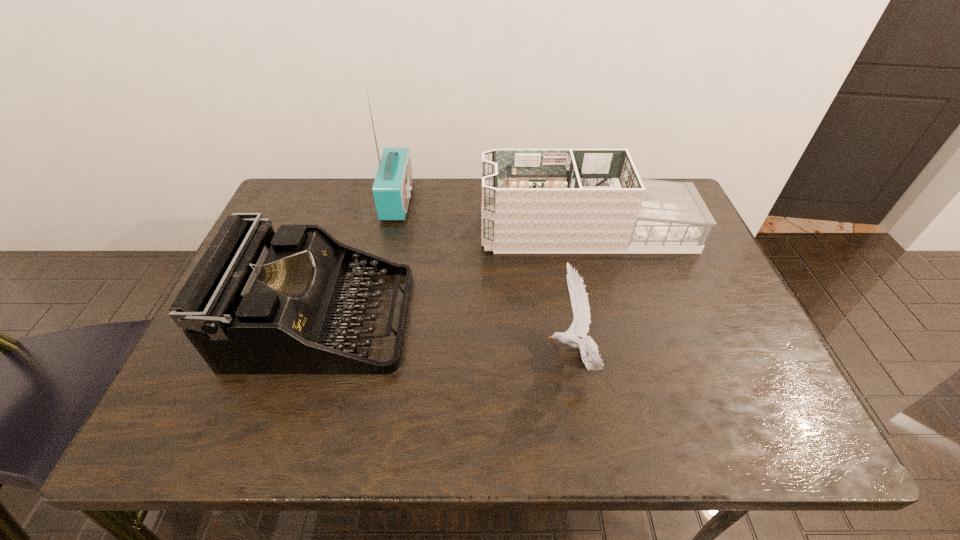
Identify the location of free space located 0.110m at the tip of the beak of the shortest object. The image size is (960, 540). (495, 354).

I want to click on free space located at the tip of the beak of the shortest object, so click(514, 354).

Locate an element on the screen. The height and width of the screenshot is (540, 960). radio receiver positioned at the far edge is located at coordinates (392, 186).

Identify the location of dollhouse that is at the far edge. (533, 200).

Where is `object located in the near edge section of the desktop`? This screenshot has height=540, width=960. object located in the near edge section of the desktop is located at coordinates (588, 348).

Where is `object located at the left edge`? The image size is (960, 540). object located at the left edge is located at coordinates (258, 302).

Where is `object positioned at the right edge`? object positioned at the right edge is located at coordinates (533, 200).

At what (x,y) coordinates should I click in order to perform the action: click on object present at the far right corner. Please return your answer as a coordinate pair (x, y). Looking at the image, I should click on (533, 200).

The width and height of the screenshot is (960, 540). Find the location of `free spot at the far edge of the desktop`. free spot at the far edge of the desktop is located at coordinates (446, 181).

This screenshot has height=540, width=960. In order to click on vacant region at the near edge of the desktop in this screenshot , I will do `click(551, 427)`.